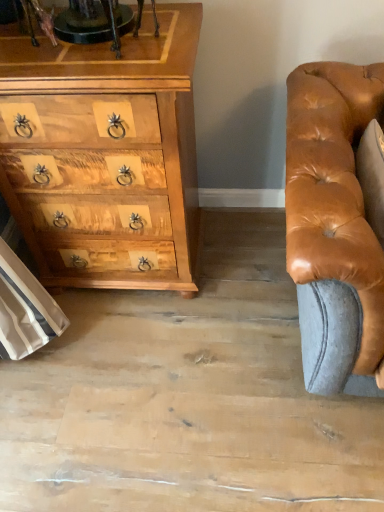
This screenshot has height=512, width=384. Identify the location of natural wood chest of drawers at left. (105, 155).

The height and width of the screenshot is (512, 384). Describe the element at coordinates (105, 155) in the screenshot. I see `natural wood chest of drawers at left` at that location.

Where is `natural wood chest of drawers at left`? This screenshot has width=384, height=512. natural wood chest of drawers at left is located at coordinates (105, 155).